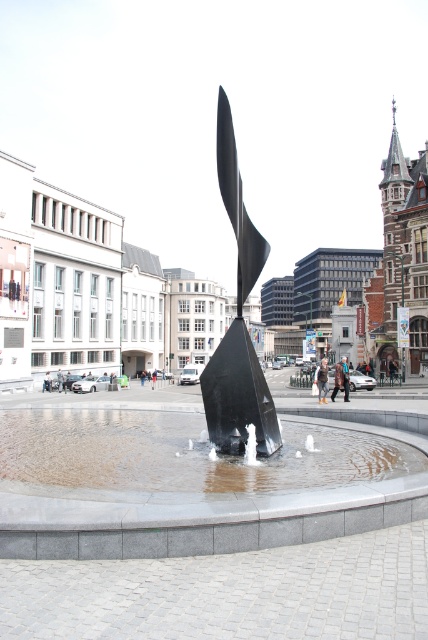
Question: Can you confirm if clear water at fountain center is positioned above polished black sculpture at center?

Choices:
 (A) yes
 (B) no

Answer: (B)

Question: Is clear water at fountain center bigger than polished black sculpture at center?

Choices:
 (A) no
 (B) yes

Answer: (A)

Question: Which point appears farthest from the camera in this image?

Choices:
 (A) (240, 365)
 (B) (365, 436)

Answer: (B)

Question: Can you confirm if clear water at fountain center is positioned to the right of polished black sculpture at center?

Choices:
 (A) yes
 (B) no

Answer: (B)

Question: Which point is farther to the camera?

Choices:
 (A) (219, 410)
 (B) (172, 452)
 (C) (119, 468)

Answer: (B)

Question: Which of the following is the farthest from the observer?

Choices:
 (A) (222, 156)
 (B) (299, 493)
 (C) (59, 429)

Answer: (C)